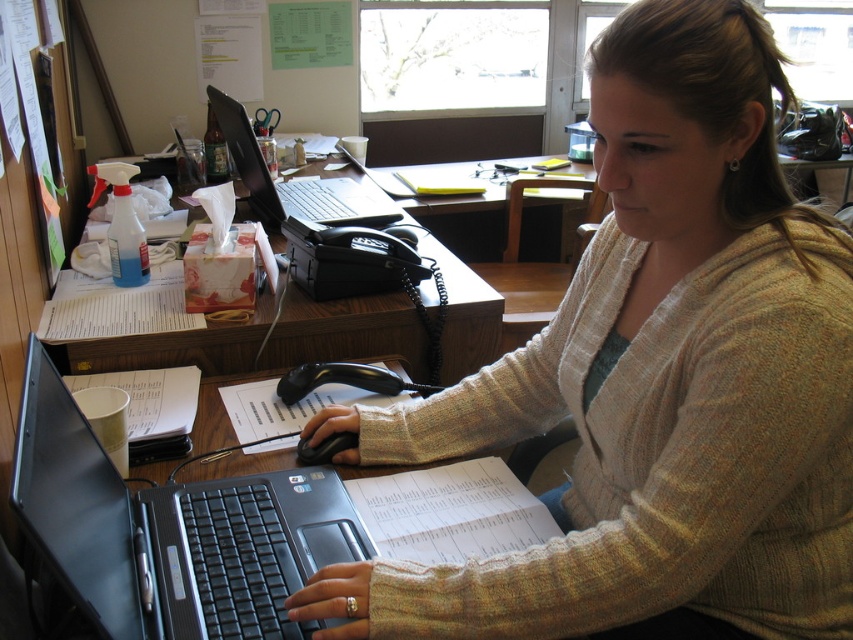
Which is above, black plastic laptop at center or matte black laptop at center?

matte black laptop at center is above.

Based on the photo, between black plastic laptop at center and matte black laptop at center, which one appears on the left side from the viewer's perspective?

Positioned to the left is matte black laptop at center.

Where is `black plastic laptop at center`? The width and height of the screenshot is (853, 640). black plastic laptop at center is located at coordinates (170, 531).

Is light beige sweater at center bigger than matte black laptop at center?

Yes.

What are the coordinates of `light beige sweater at center` in the screenshot? It's located at (654, 381).

The width and height of the screenshot is (853, 640). I want to click on light beige sweater at center, so [654, 381].

Who is positioned more to the right, light beige sweater at center or black plastic laptop at center?

light beige sweater at center

Is light beige sweater at center thinner than black plastic laptop at center?

No.

Where is `light beige sweater at center`? light beige sweater at center is located at coordinates (654, 381).

Identify the location of light beige sweater at center. The image size is (853, 640). (654, 381).